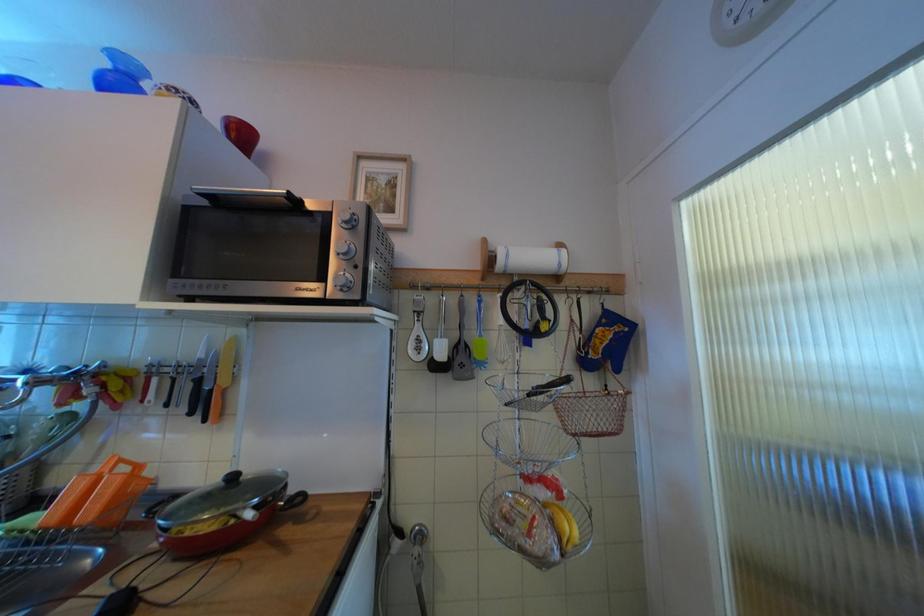
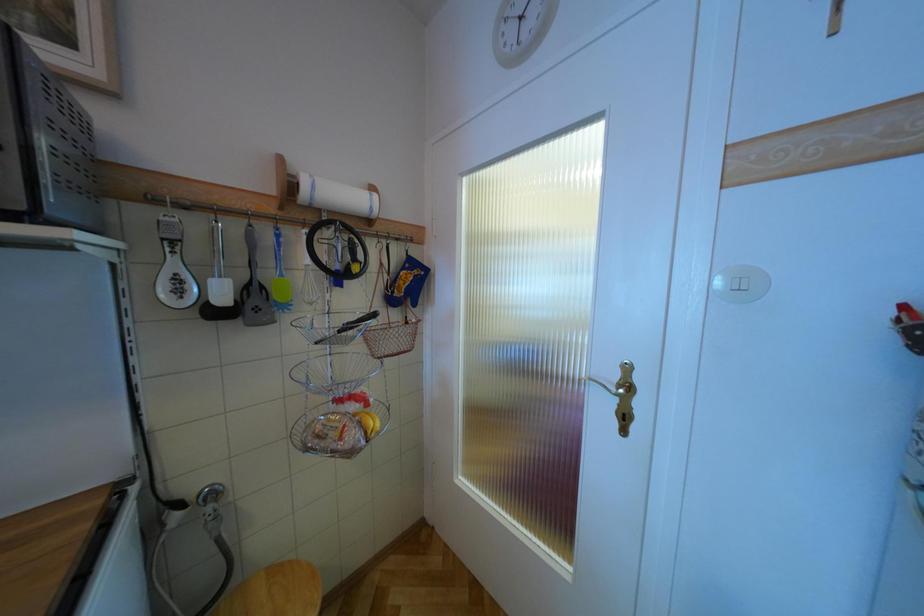
Question: The camera is either moving clockwise (left) or counter-clockwise (right) around the object. The first image is from the beginning of the video and the second image is from the end. Is the camera moving left or right when shooting the video?

Choices:
 (A) Left
 (B) Right

Answer: (A)